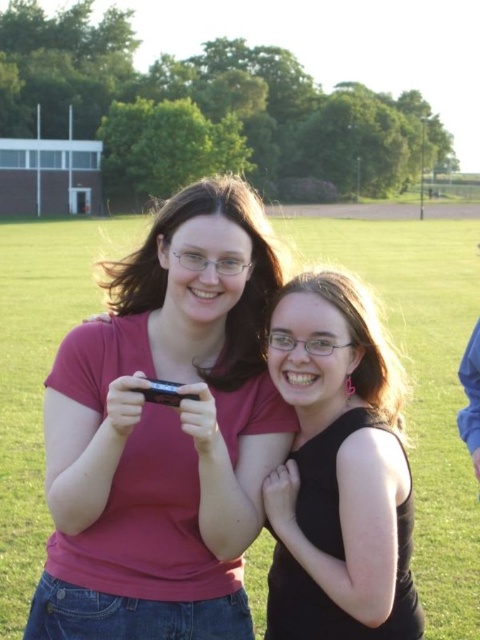
In the scene shown: You are a photographer trying to capture a group photo of two people wearing a matte pink shirt at center and a black matte tank top at center. Based on their positions, which person should stand on the left side of the photo to match the original image?

The matte pink shirt at center should stand on the left side of the photo because in the original image, the matte pink shirt at center is positioned on the left side of the black matte tank top at center.

You are standing in the field and want to take a photo of the two people. You notice a point at coordinates point (105, 428) that is 3.90 meters away from you. If you move forward 2 meters towards them, will you be closer than 2 meters to the point?

The point at point (105, 428) is initially 3.90 meters away. Moving forward 2 meters reduces the distance to 1.90 meters, which is less than 2 meters. Yes, you will be closer than 2 meters to the point.

You are a photographer trying to capture a portrait of two people wearing the matte pink shirt at center and the black matte tank top at center. Which person should you position closer to the camera to ensure both are in focus?

Since the matte pink shirt at center is taller than the black matte tank top at center, you should position the black matte tank top at center closer to the camera to ensure both are in focus.